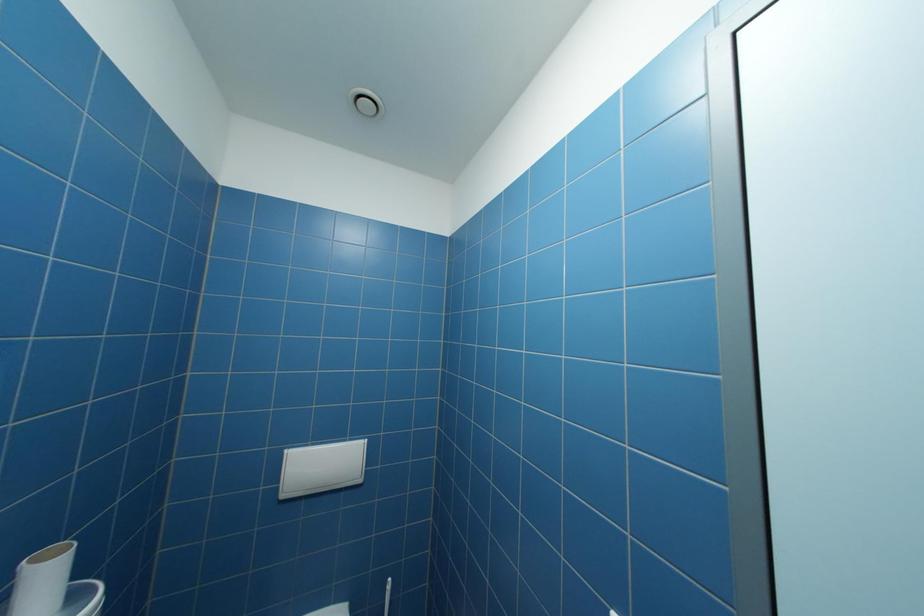
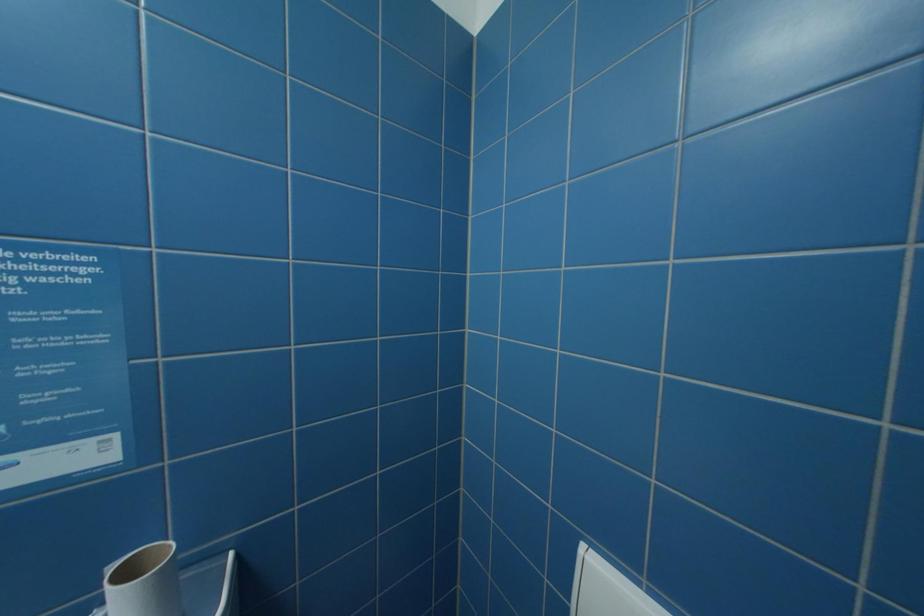
Question: The camera is either moving clockwise (left) or counter-clockwise (right) around the object. The first image is from the beginning of the video and the second image is from the end. Is the camera moving left or right when shooting the video?

Choices:
 (A) Left
 (B) Right

Answer: (B)